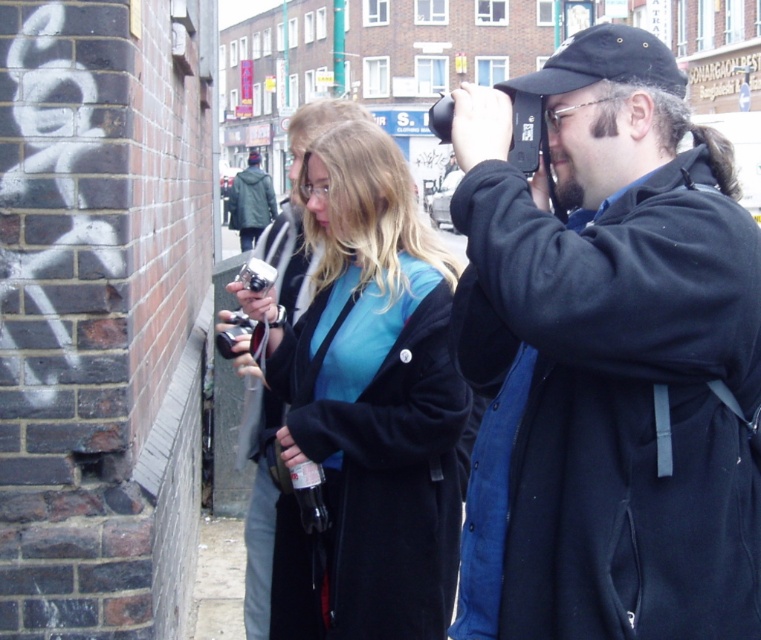
You are a photographer trying to position yourself between the matte black jacket at center and the green matte jacket at center. Which direction should you move to be between them?

To be between the matte black jacket at center and the green matte jacket at center, you should move to the left side of the matte black jacket at center since it is positioned on the right side of the green matte jacket at center.

You are a photographer standing at the edge of the scene. You want to move from the matte black jacket at center to the blue matte jacket at center to adjust their position. Can you walk directly between them without stepping into the foreground or middle ground areas?

The matte black jacket at center is 2.22 meters away from the blue matte jacket at center. Since the distance between them is over 2 meters, you can walk directly between them without entering the foreground or middle ground areas.

You are standing in the street scene described. You need to place a small tripod between the matte black jacket at center and the blue matte jacket at center. Which direction should you place it so it fits between them?

You should place the tripod to the left of the matte black jacket at center since the matte black jacket at center is to the right of the blue matte jacket at center, meaning the blue matte jacket at center is on the left side.